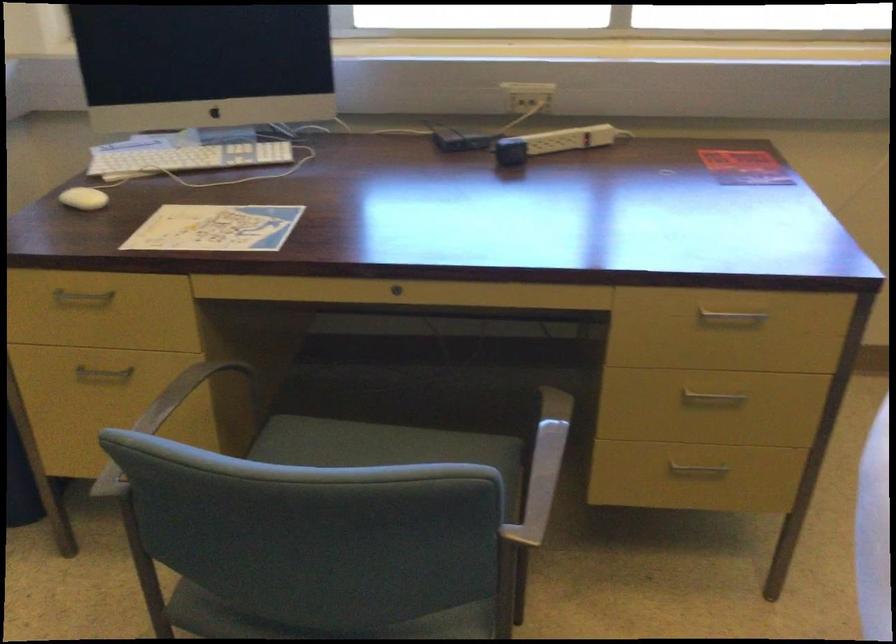
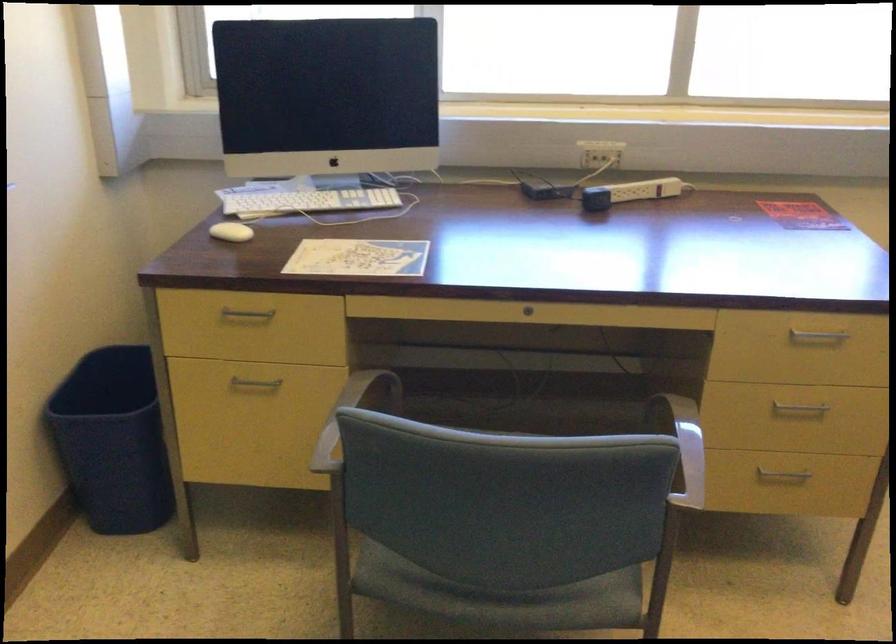
Locate, in the second image, the point that corresponds to the point at 80,199 in the first image.

(230, 232)